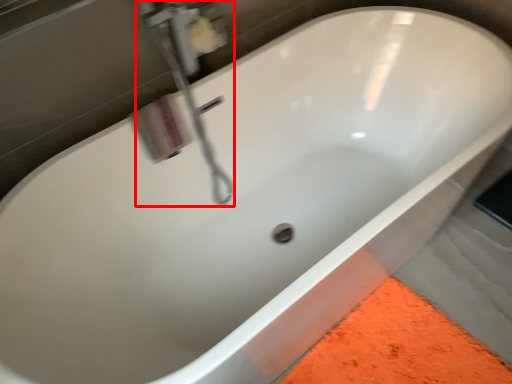
Question: From the image's perspective, considering the relative positions of plumbing fixture (annotated by the red box) and plumbing fixture in the image provided, where is plumbing fixture (annotated by the red box) located with respect to the staircase?

Choices:
 (A) above
 (B) below

Answer: (B)